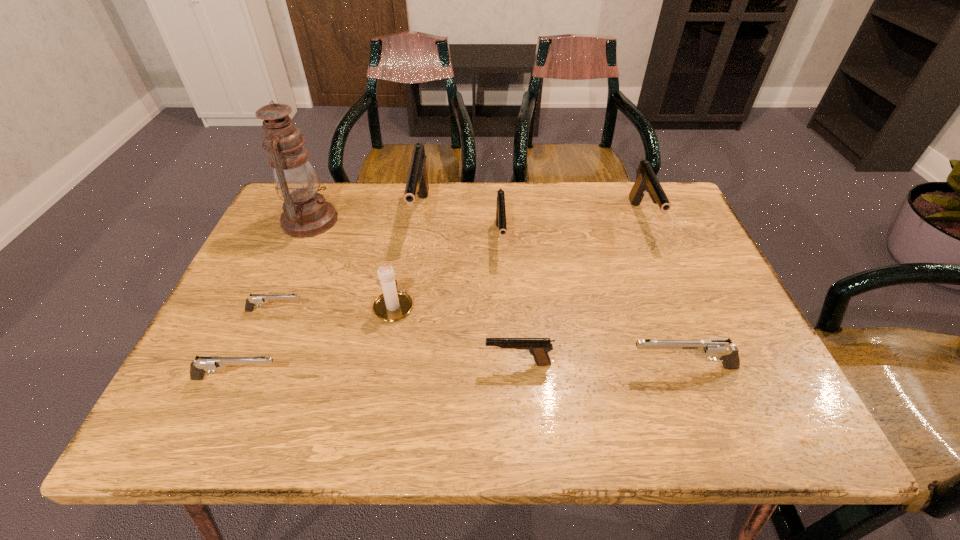
At what (x,y) coordinates should I click in order to perform the action: click on oil lamp that is at the far edge. Please return your answer as a coordinate pair (x, y). The height and width of the screenshot is (540, 960). Looking at the image, I should click on (306, 213).

Identify the location of oil lamp located in the left edge section of the desktop. The height and width of the screenshot is (540, 960). (306, 213).

Image resolution: width=960 pixels, height=540 pixels. I want to click on object located at the far left corner, so click(x=306, y=213).

What are the coordinates of `object that is at the far right corner` in the screenshot? It's located at (646, 181).

Image resolution: width=960 pixels, height=540 pixels. I want to click on vacant space at the far edge, so click(570, 200).

In order to click on free space at the near edge of the desktop in this screenshot , I will do `click(697, 401)`.

The image size is (960, 540). I want to click on free space at the left edge, so click(226, 343).

At what (x,y) coordinates should I click in order to perform the action: click on vacant point at the right edge. Please return your answer as a coordinate pair (x, y). Image resolution: width=960 pixels, height=540 pixels. Looking at the image, I should click on (691, 283).

At what (x,y) coordinates should I click in order to perform the action: click on vacant space at the far right corner of the desktop. Please return your answer as a coordinate pair (x, y). Looking at the image, I should click on point(686,227).

Locate an element on the screen. vacant space in between the farthest silver pistol and the candle holder is located at coordinates (335, 308).